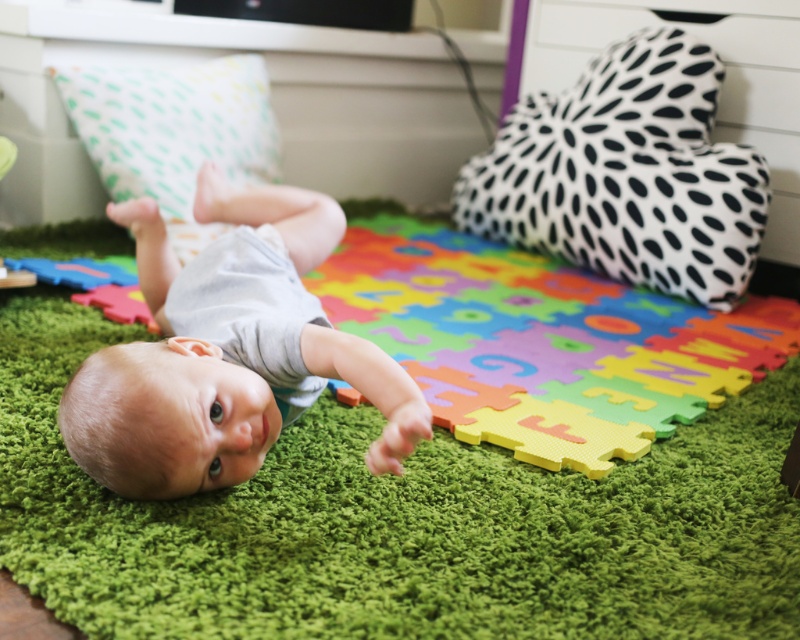
You are a parent trying to place a toy on the green foam puzzle mat at center so your baby can reach it. Based on the scene, where should you place the toy relative to the smooth gray baby at center?

The green foam puzzle mat at center is in front of the smooth gray baby at center, so you should place the toy in front of the baby to ensure it is on the mat.

You are a parent trying to place a new toy on the green foam puzzle mat at center. However, there is a rubberized foam puzzle piece at lower left nearby. Which object should you place the toy on to ensure it stays visible?

You should place the toy on the green foam puzzle mat at center because it is in front of the rubberized foam puzzle piece at lower left, making it more visible.

You are a parent trying to give your baby a toy. The smooth gray baby at center is lying on a green rug, and there is a rubberized foam puzzle piece at lower left nearby. Which object is closer to you?

The smooth gray baby at center is closer to the viewer than the rubberized foam puzzle piece at lower left.